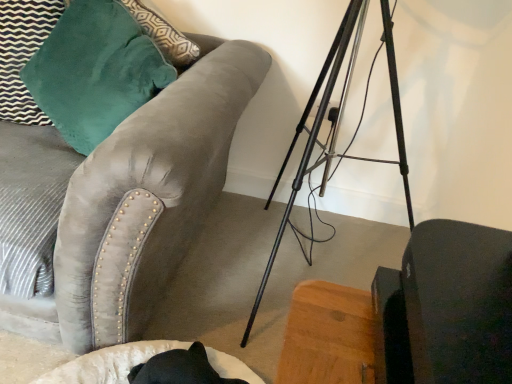
What do you see at coordinates (448, 306) in the screenshot? I see `matte black swivel chair at lower right` at bounding box center [448, 306].

At what (x,y) coordinates should I click in order to perform the action: click on velvet teal pillow at upper left. Please return your answer as a coordinate pair (x, y). Image resolution: width=512 pixels, height=384 pixels. Looking at the image, I should click on (95, 71).

The height and width of the screenshot is (384, 512). Identify the location of matte black swivel chair at lower right. pos(448,306).

Consider the image. Who is taller, velvet gray couch at upper left or matte black swivel chair at lower right?

Standing taller between the two is velvet gray couch at upper left.

From the image's perspective, which one is positioned lower, velvet gray couch at upper left or matte black swivel chair at lower right?

matte black swivel chair at lower right.

In the scene shown: Considering the relative sizes of velvet gray couch at upper left and matte black swivel chair at lower right in the image provided, is velvet gray couch at upper left smaller than matte black swivel chair at lower right?

No.

Is velvet gray couch at upper left far away from matte black swivel chair at lower right?

No, velvet gray couch at upper left is not far from matte black swivel chair at lower right.

From the picture: Is matte black swivel chair at lower right facing away from velvet gray couch at upper left?

matte black swivel chair at lower right does not have its back to velvet gray couch at upper left.

In the image, there is a velvet gray couch at upper left. Identify the location of swivel chair below it (from the image's perspective). The width and height of the screenshot is (512, 384). (448, 306).

Can you see matte black swivel chair at lower right touching velvet gray couch at upper left?

There is a gap between matte black swivel chair at lower right and velvet gray couch at upper left.

Which is more to the right, matte black swivel chair at lower right or velvet gray couch at upper left?

From the viewer's perspective, matte black swivel chair at lower right appears more on the right side.

Is velvet teal pillow at upper left touching matte black swivel chair at lower right?

No, velvet teal pillow at upper left is not next to matte black swivel chair at lower right.

This screenshot has width=512, height=384. I want to click on throw pillow located underneath the matte black swivel chair at lower right (from a real-world perspective), so click(x=95, y=71).

Considering the relative sizes of velvet teal pillow at upper left and matte black swivel chair at lower right in the image provided, is velvet teal pillow at upper left wider than matte black swivel chair at lower right?

Yes, velvet teal pillow at upper left is wider than matte black swivel chair at lower right.

Between velvet teal pillow at upper left and matte black swivel chair at lower right, which one has smaller size?

matte black swivel chair at lower right.

From the image's perspective, which object appears higher, velvet gray couch at upper left or velvet teal pillow at upper left?

velvet teal pillow at upper left appears higher in the image.

In the scene shown: Would you consider velvet gray couch at upper left to be distant from velvet teal pillow at upper left?

No, velvet gray couch at upper left is not far away from velvet teal pillow at upper left.

Would you say velvet teal pillow at upper left is part of velvet gray couch at upper left's contents?

Yes, velvet gray couch at upper left contains velvet teal pillow at upper left.

How many degrees apart are the facing directions of velvet gray couch at upper left and velvet teal pillow at upper left?

The angular difference between velvet gray couch at upper left and velvet teal pillow at upper left is 10.3 degrees.

Between velvet teal pillow at upper left and velvet gray couch at upper left, which one has smaller size?

velvet teal pillow at upper left is smaller.

Could you tell me if velvet teal pillow at upper left is turned towards velvet gray couch at upper left?

Yes.

The image size is (512, 384). Find the location of `throw pillow above the velvet gray couch at upper left (from a real-world perspective)`. throw pillow above the velvet gray couch at upper left (from a real-world perspective) is located at coordinates (95, 71).

Would you consider velvet teal pillow at upper left to be distant from velvet gray couch at upper left?

No, velvet teal pillow at upper left is in close proximity to velvet gray couch at upper left.

This screenshot has height=384, width=512. In order to click on throw pillow behind the matte black swivel chair at lower right in this screenshot , I will do [x=95, y=71].

Is matte black swivel chair at lower right smaller than velvet teal pillow at upper left?

Indeed, matte black swivel chair at lower right has a smaller size compared to velvet teal pillow at upper left.

Would you say matte black swivel chair at lower right is outside velvet teal pillow at upper left?

matte black swivel chair at lower right lies outside velvet teal pillow at upper left's area.

From their relative heights in the image, would you say matte black swivel chair at lower right is taller or shorter than velvet teal pillow at upper left?

Considering their sizes, matte black swivel chair at lower right has less height than velvet teal pillow at upper left.

Locate an element on the screen. The width and height of the screenshot is (512, 384). swivel chair positioned vertically above the velvet gray couch at upper left (from a real-world perspective) is located at coordinates (448, 306).

In order to click on studio couch behind the matte black swivel chair at lower right in this screenshot , I will do `click(141, 203)`.

Estimate the real-world distances between objects in this image. Which object is further from velvet gray couch at upper left, matte black swivel chair at lower right or velvet teal pillow at upper left?

matte black swivel chair at lower right lies further to velvet gray couch at upper left than the other object.

Based on their spatial positions, is velvet gray couch at upper left or matte black swivel chair at lower right further from velvet teal pillow at upper left?

matte black swivel chair at lower right lies further to velvet teal pillow at upper left than the other object.

Looking at the image, which one is located closer to matte black swivel chair at lower right, velvet gray couch at upper left or velvet teal pillow at upper left?

velvet gray couch at upper left is closer to matte black swivel chair at lower right.

When comparing their distances from velvet teal pillow at upper left, does matte black swivel chair at lower right or velvet gray couch at upper left seem closer?

velvet gray couch at upper left lies closer to velvet teal pillow at upper left than the other object.

Based on their spatial positions, is velvet teal pillow at upper left or velvet gray couch at upper left further from matte black swivel chair at lower right?

velvet teal pillow at upper left is positioned further to the anchor matte black swivel chair at lower right.

Considering their positions, is velvet teal pillow at upper left positioned further to velvet gray couch at upper left than matte black swivel chair at lower right?

Based on the image, matte black swivel chair at lower right appears to be further to velvet gray couch at upper left.

Find the location of a particular element. The height and width of the screenshot is (384, 512). studio couch between matte black swivel chair at lower right and velvet teal pillow at upper left in the front-back direction is located at coordinates (141, 203).